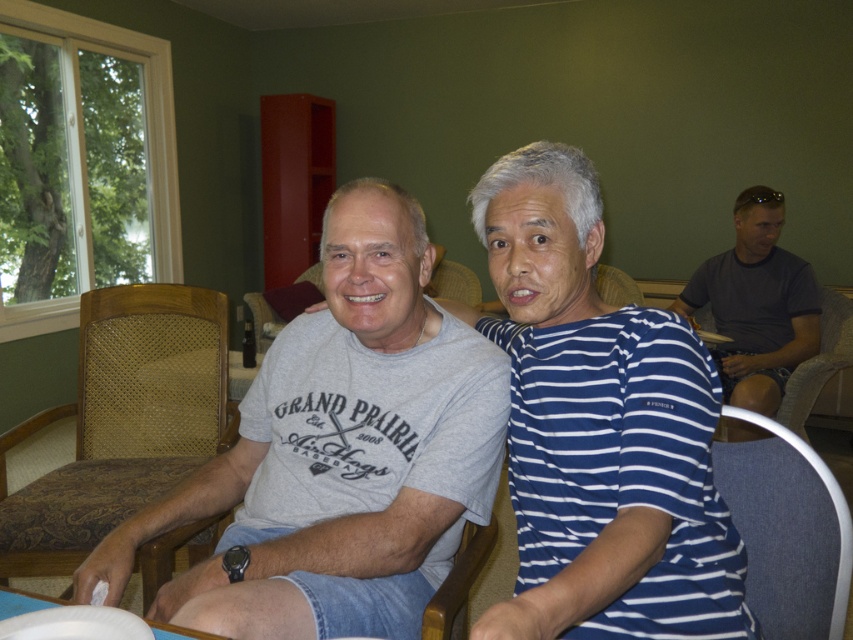
You are at a picnic and want to reach the white paper plate at lower left and the white plastic plate at lower left. Which plate is closer to you?

The white paper plate at lower left is closer to you because it is in front of the white plastic plate at lower left.

You are standing in the room and want to place a new object at the same location as the white paper plate at lower left. What coordinates should you use?

The coordinates for the white paper plate at lower left are at point (74, 625).